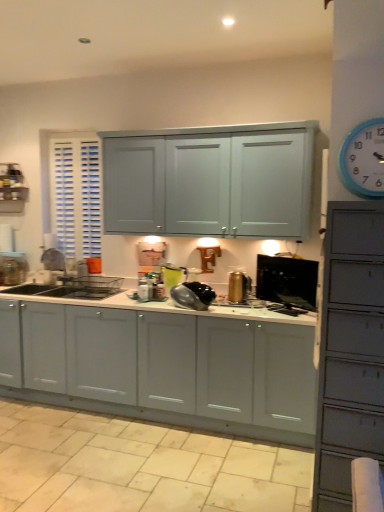
Locate an element on the screen. vacant space situated on the left part of metallic silver toaster at center, which is the 1th appliance in left-to-right order is located at coordinates (120, 297).